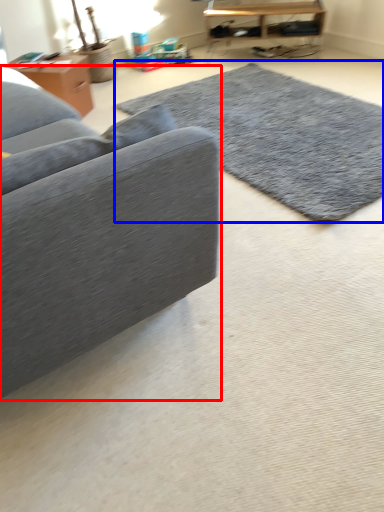
Question: Which object is further to the camera taking this photo, studio couch (highlighted by a red box) or mat (highlighted by a blue box)?

Choices:
 (A) studio couch
 (B) mat

Answer: (B)